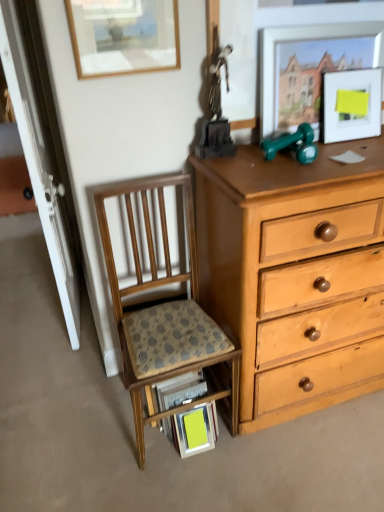
Question: Considering the relative sizes of wooden desk at lower center and matte white picture frame at upper right, the first picture frame from the right, in the image provided, is wooden desk at lower center wider than matte white picture frame at upper right, the first picture frame from the right,?

Choices:
 (A) yes
 (B) no

Answer: (A)

Question: From the image's perspective, would you say wooden desk at lower center is positioned over matte white picture frame at upper right, which ranks as the 3th picture frame in left-to-right order?

Choices:
 (A) no
 (B) yes

Answer: (A)

Question: Can you confirm if wooden desk at lower center is positioned to the right of matte white picture frame at upper right, which ranks as the 3th picture frame in left-to-right order?

Choices:
 (A) no
 (B) yes

Answer: (A)

Question: Is wooden desk at lower center not within matte white picture frame at upper right, the first picture frame from the right?

Choices:
 (A) no
 (B) yes

Answer: (B)

Question: From a real-world perspective, does wooden desk at lower center sit lower than matte white picture frame at upper right, the first picture frame from the right?

Choices:
 (A) yes
 (B) no

Answer: (A)

Question: From the image's perspective, is matte silver picture frame at upper right, the second picture frame in the right-to-left sequence, located above or below wooden picture frame at upper left, positioned as the 3th picture frame in right-to-left order?

Choices:
 (A) above
 (B) below

Answer: (B)

Question: Is point (301, 29) closer or farther from the camera than point (119, 26)?

Choices:
 (A) farther
 (B) closer

Answer: (A)

Question: Is matte silver picture frame at upper right, which ranks as the 2th picture frame in left-to-right order, wider or thinner than wooden picture frame at upper left, positioned as the 3th picture frame in right-to-left order?

Choices:
 (A) wide
 (B) thin

Answer: (A)

Question: Do you think matte silver picture frame at upper right, which ranks as the 2th picture frame in left-to-right order, is within wooden picture frame at upper left, positioned as the 3th picture frame in right-to-left order, or outside of it?

Choices:
 (A) inside
 (B) outside

Answer: (B)

Question: Is matte white picture frame at upper right, the first picture frame from the right, spatially inside green rubber dumbbells at upper right, or outside of it?

Choices:
 (A) outside
 (B) inside

Answer: (A)

Question: From the image's perspective, is matte white picture frame at upper right, which ranks as the 3th picture frame in left-to-right order, positioned above or below green rubber dumbbells at upper right?

Choices:
 (A) above
 (B) below

Answer: (A)

Question: Is matte white picture frame at upper right, the first picture frame from the right, in front of or behind green rubber dumbbells at upper right in the image?

Choices:
 (A) behind
 (B) front

Answer: (A)

Question: From a real-world perspective, is matte white picture frame at upper right, which ranks as the 3th picture frame in left-to-right order, positioned above or below green rubber dumbbells at upper right?

Choices:
 (A) above
 (B) below

Answer: (A)

Question: Considering the positions of point (79, 40) and point (195, 369), is point (79, 40) closer or farther from the camera than point (195, 369)?

Choices:
 (A) closer
 (B) farther

Answer: (A)

Question: Is wooden picture frame at upper left, positioned as the 3th picture frame in right-to-left order, taller or shorter than wooden desk at lower center?

Choices:
 (A) short
 (B) tall

Answer: (A)